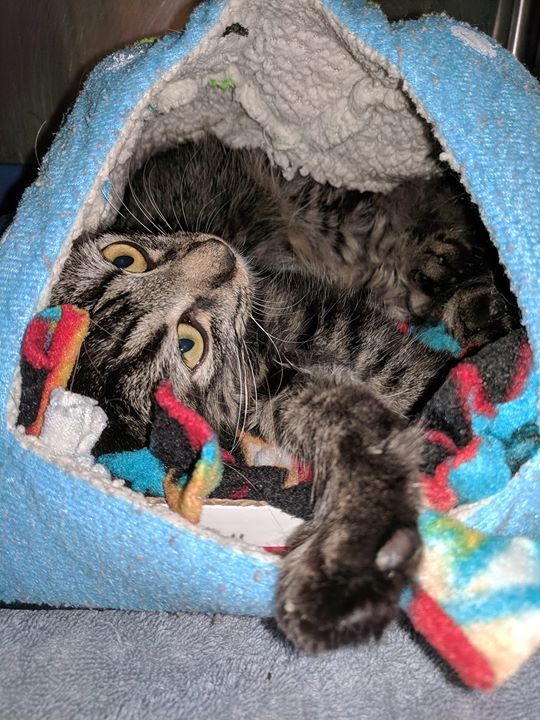
This screenshot has width=540, height=720. What are the coordinates of `box` in the screenshot? It's located at (251, 521).